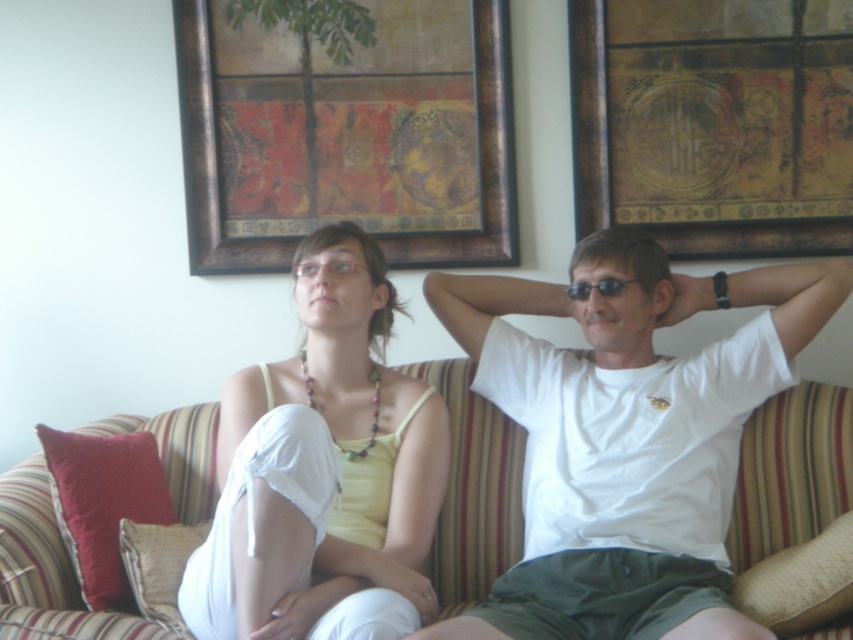
Is wooden framed artwork at upper center thinner than beige fabric pillow at lower right?

In fact, wooden framed artwork at upper center might be wider than beige fabric pillow at lower right.

This screenshot has width=853, height=640. What do you see at coordinates (346, 129) in the screenshot? I see `wooden framed artwork at upper center` at bounding box center [346, 129].

What are the coordinates of `wooden framed artwork at upper center` in the screenshot? It's located at (346, 129).

Which is in front, point (389, 372) or point (71, 456)?

Point (71, 456) is in front.

Between point (347, 474) and point (78, 545), which one is positioned behind?

The point (347, 474) is behind.

The height and width of the screenshot is (640, 853). What are the coordinates of `white fabric at center` in the screenshot? It's located at (323, 472).

Measure the distance between white cotton t-shirt at right and white fabric at center.

The distance of white cotton t-shirt at right from white fabric at center is 28.75 centimeters.

Based on the photo, who is higher up, white cotton t-shirt at right or white fabric at center?

Positioned higher is white fabric at center.

Describe the element at coordinates (627, 436) in the screenshot. The width and height of the screenshot is (853, 640). I see `white cotton t-shirt at right` at that location.

At what (x,y) coordinates should I click in order to perform the action: click on white cotton t-shirt at right. Please return your answer as a coordinate pair (x, y). This screenshot has width=853, height=640. Looking at the image, I should click on (627, 436).